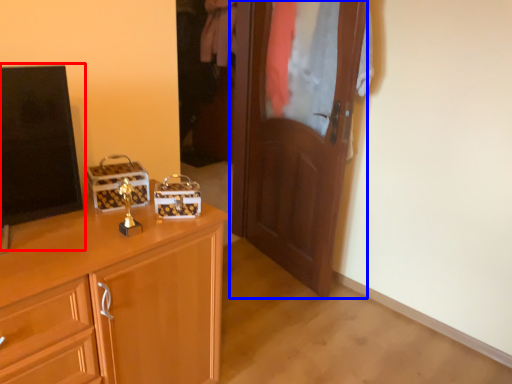
Question: Which point is closer to the camera, tv show (highlighted by a red box) or door (highlighted by a blue box)?

Choices:
 (A) tv show
 (B) door

Answer: (A)